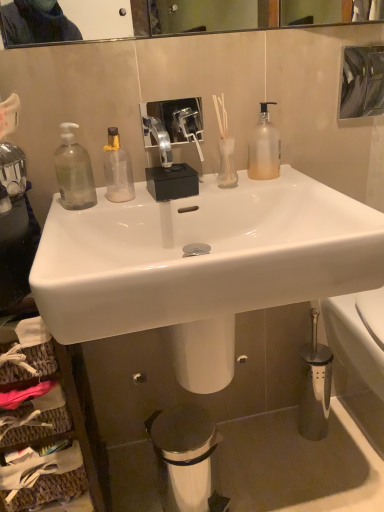
This screenshot has width=384, height=512. In order to click on vacant region under white glossy toilet at lower right (from a real-world perspective) in this screenshot , I will do `click(364, 428)`.